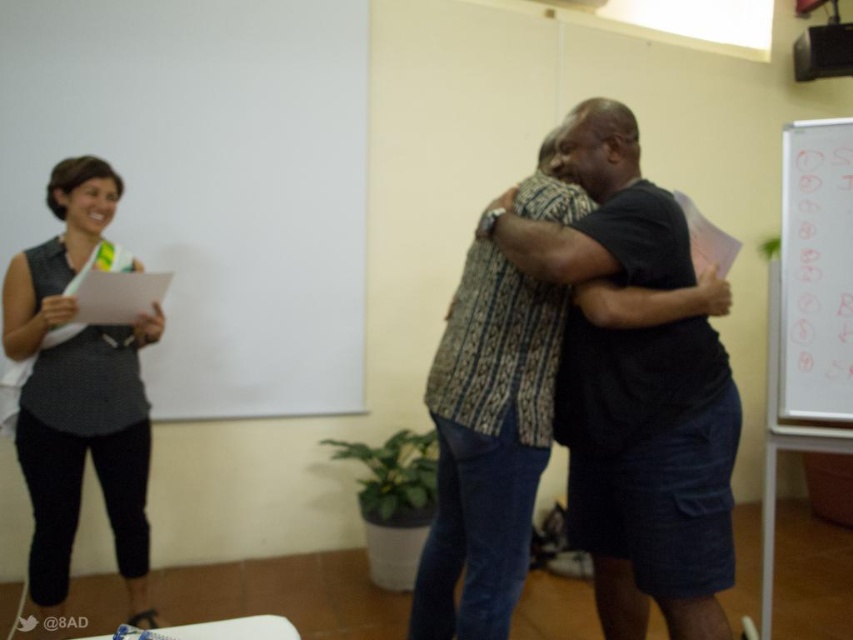
Question: Which object appears closest to the camera in this image?

Choices:
 (A) patterned fabric shirt at center
 (B) dark blue textured shorts at center

Answer: (B)

Question: Which of the following is the farthest from the observer?

Choices:
 (A) (148, 312)
 (B) (682, 253)
 (C) (476, 452)

Answer: (A)

Question: Can you confirm if patterned fabric shirt at center is thinner than whiteboard at right?

Choices:
 (A) no
 (B) yes

Answer: (A)

Question: Which of these objects is positioned farthest from the whiteboard at right?

Choices:
 (A) dark blue textured shorts at center
 (B) patterned fabric shirt at center
 (C) matte gray shirt at left

Answer: (C)

Question: Is patterned fabric shirt at center positioned in front of matte gray shirt at left?

Choices:
 (A) yes
 (B) no

Answer: (A)

Question: Does matte gray shirt at left have a greater width compared to whiteboard at right?

Choices:
 (A) yes
 (B) no

Answer: (A)